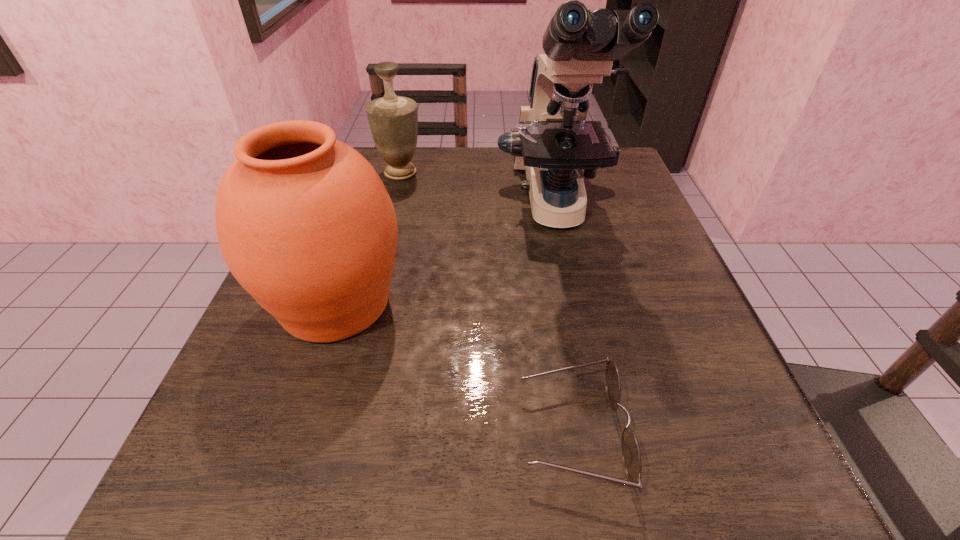
Where is `vacant space at the near edge of the desktop`? The width and height of the screenshot is (960, 540). vacant space at the near edge of the desktop is located at coordinates (533, 512).

Image resolution: width=960 pixels, height=540 pixels. In the image, there is a desktop. Identify the location of vacant space at the left edge. (319, 416).

This screenshot has height=540, width=960. I want to click on vacant region at the right edge of the desktop, so click(x=729, y=379).

This screenshot has height=540, width=960. In the image, there is a desktop. What are the coordinates of `vacant space at the near left corner` in the screenshot? It's located at (212, 482).

At what (x,y) coordinates should I click in order to perform the action: click on vacant space at the far right corner of the desktop. Please return your answer as a coordinate pair (x, y). The image size is (960, 540). Looking at the image, I should click on (612, 182).

Where is `free space at the near right corner`? This screenshot has width=960, height=540. free space at the near right corner is located at coordinates (761, 509).

What are the coordinates of `free space between the shortest object and the farther urn` in the screenshot? It's located at (487, 302).

Image resolution: width=960 pixels, height=540 pixels. Identify the location of vacant area that lies between the second shortest object and the spectacles. (487, 302).

You are a GUI agent. You are given a task and a screenshot of the screen. Output one action in this format:
    pyautogui.click(x=<x>, y=<y>)
    Task: Click on the blank region between the microscope and the shorter urn
    The width and height of the screenshot is (960, 540).
    Given the screenshot: What is the action you would take?
    [x=478, y=190]

The width and height of the screenshot is (960, 540). In order to click on unoccupied position between the tallest object and the spectacles in this screenshot , I will do `click(564, 320)`.